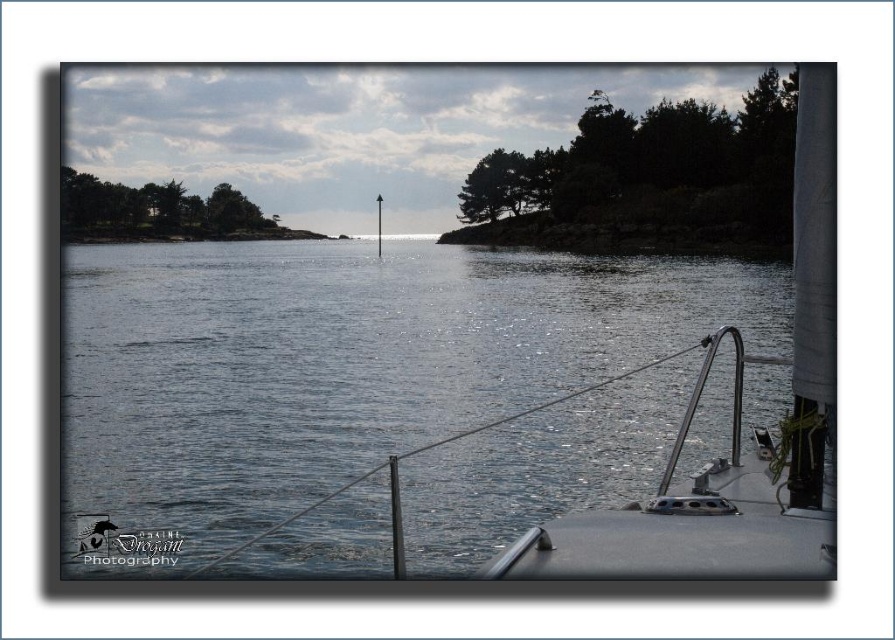
Question: Does glossy water at center have a greater width compared to polished stainless steel boat at right?

Choices:
 (A) yes
 (B) no

Answer: (A)

Question: Which point is farther from the camera taking this photo?

Choices:
 (A) (209, 376)
 (B) (797, 570)

Answer: (A)

Question: Does glossy water at center have a smaller size compared to polished stainless steel boat at right?

Choices:
 (A) no
 (B) yes

Answer: (A)

Question: Can you confirm if glossy water at center is positioned to the left of polished stainless steel boat at right?

Choices:
 (A) yes
 (B) no

Answer: (A)

Question: Which point is farther to the camera?

Choices:
 (A) glossy water at center
 (B) polished stainless steel boat at right

Answer: (B)